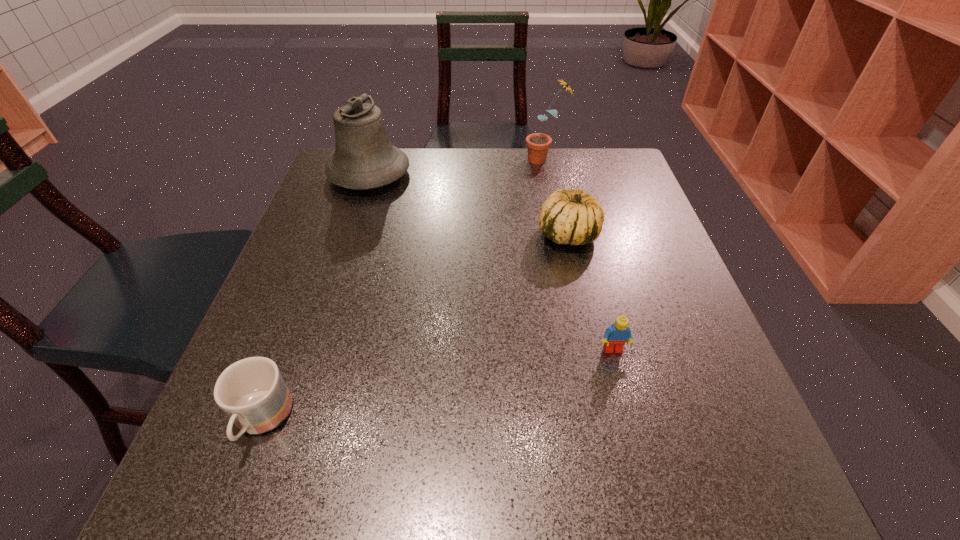
Where is `object that is at the far left corner`? Image resolution: width=960 pixels, height=540 pixels. object that is at the far left corner is located at coordinates (364, 158).

You are a GUI agent. You are given a task and a screenshot of the screen. Output one action in this format:
    pyautogui.click(x=<x>, y=<y>)
    Task: Click on the object that is at the near left corner
    The width and height of the screenshot is (960, 540).
    Given the screenshot: What is the action you would take?
    pyautogui.click(x=252, y=392)

Find the location of a particular element. blank space at the far edge of the desktop is located at coordinates (509, 167).

Locate an element on the screen. free region at the near edge is located at coordinates (435, 470).

Locate an element on the screen. This screenshot has width=960, height=540. blank space at the left edge of the desktop is located at coordinates (324, 246).

Image resolution: width=960 pixels, height=540 pixels. In order to click on vacant region at the right edge of the desktop in this screenshot , I will do `click(609, 271)`.

In the image, there is a desktop. At what (x,y) coordinates should I click in order to perform the action: click on vacant space at the far left corner. Please return your answer as a coordinate pair (x, y). Image resolution: width=960 pixels, height=540 pixels. Looking at the image, I should click on (321, 193).

Identify the location of vacant area at the far right corner of the desktop. (640, 187).

Where is `blank area at the near right corner`? The height and width of the screenshot is (540, 960). blank area at the near right corner is located at coordinates (690, 472).

Where is `free space between the nearest object and the sunflower`? free space between the nearest object and the sunflower is located at coordinates (403, 290).